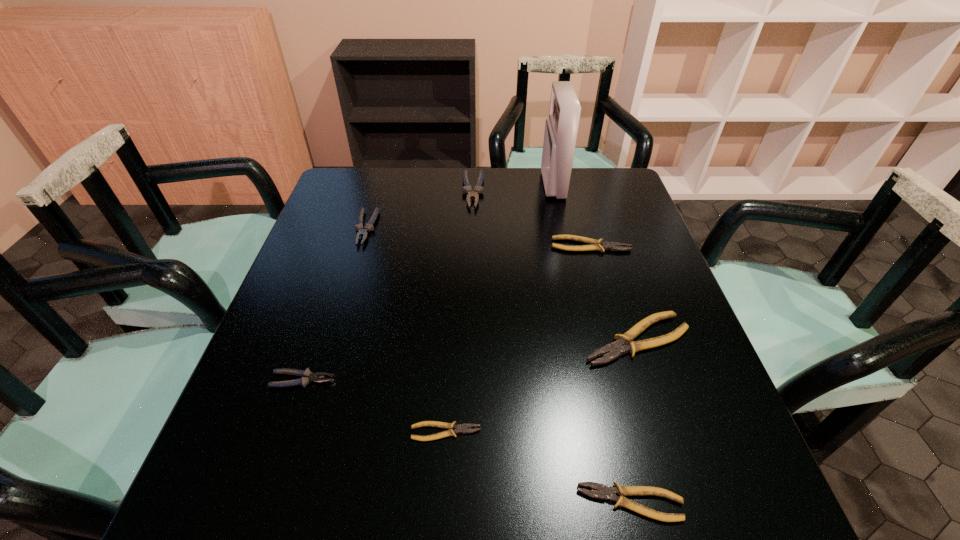
At what (x,y) coordinates should I click in order to perform the action: click on free space located 0.200m on the back of the second biggest yellow pliers. Please return your answer as a coordinate pair (x, y). This screenshot has height=540, width=960. Looking at the image, I should click on (577, 196).

The image size is (960, 540). In order to click on vacant space located 0.090m at the gripping part of the nearest gray pliers in this screenshot , I will do `click(380, 380)`.

At what (x,y) coordinates should I click in order to perform the action: click on blank space located 0.280m on the back of the nearest object. Please return your answer as a coordinate pair (x, y). The width and height of the screenshot is (960, 540). Looking at the image, I should click on (595, 348).

At what (x,y) coordinates should I click in order to perform the action: click on free spot located 0.180m on the right of the sixth farthest pliers. Please return your answer as a coordinate pair (x, y). The image size is (960, 540). Looking at the image, I should click on (579, 432).

Find the location of a particular element. the first-aid kit that is at the far edge is located at coordinates (561, 128).

This screenshot has width=960, height=540. In order to click on object that is at the near edge in this screenshot , I will do `click(604, 492)`.

Locate an element on the screen. Image resolution: width=960 pixels, height=540 pixels. object that is at the far left corner is located at coordinates (362, 231).

Locate an element on the screen. object that is at the near right corner is located at coordinates (604, 492).

In order to click on free region at the far edge in this screenshot , I will do `click(443, 196)`.

In the image, there is a desktop. Identify the location of vacant area at the near edge. (644, 504).